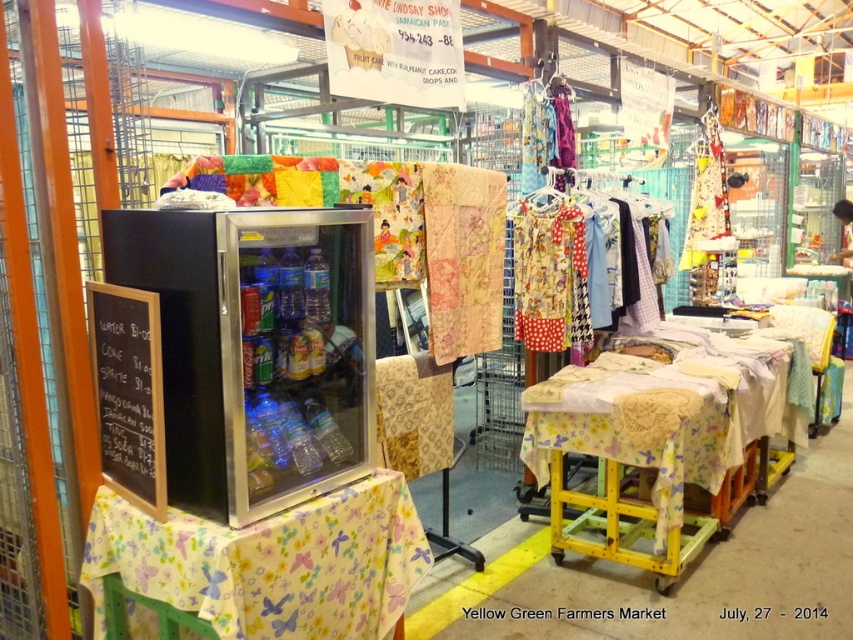
Question: From the image, what is the correct spatial relationship of butterfly-patterned fabric at lower left in relation to black chalkboard at left?

Choices:
 (A) left
 (B) right

Answer: (B)

Question: Estimate the real-world distances between objects in this image. Which object is closer to the patchwork fabric at center?

Choices:
 (A) butterfly-patterned fabric at lower left
 (B) black chalkboard at left
 (C) polka dot fabric dress at center

Answer: (C)

Question: Is patchwork fabric at center above black chalkboard at left?

Choices:
 (A) no
 (B) yes

Answer: (B)

Question: Does butterfly-patterned fabric at lower left appear over patchwork fabric at center?

Choices:
 (A) yes
 (B) no

Answer: (B)

Question: Which object is closer to the camera taking this photo?

Choices:
 (A) black chalkboard at left
 (B) patchwork fabric at center
 (C) polka dot fabric dress at center
 (D) butterfly-patterned fabric at lower left

Answer: (D)

Question: Which object is the farthest from the butterfly-patterned fabric at lower left?

Choices:
 (A) black chalkboard at left
 (B) patchwork fabric at center
 (C) polka dot fabric dress at center

Answer: (C)